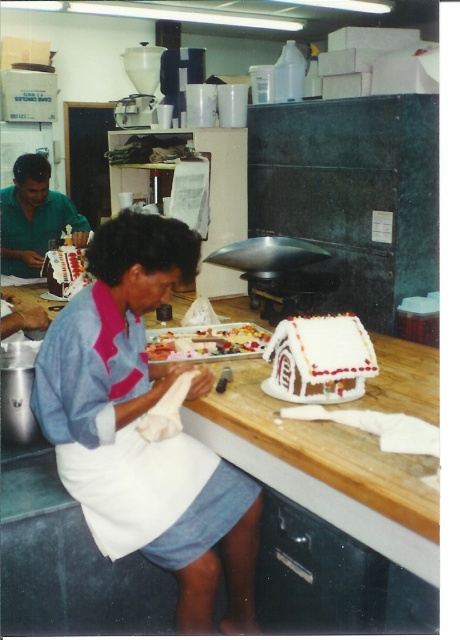
Question: Which of the following is the farthest from the observer?

Choices:
 (A) (356, 317)
 (B) (387, 488)
 (C) (212, 346)

Answer: (C)

Question: Among these objects, which one is farthest from the camera?

Choices:
 (A) white frosted gingerbread house at center
 (B) glazed sugar cookies at center
 (C) green matte shirt at upper left
 (D) blue fabric shirt at center

Answer: (C)

Question: Among these objects, which one is farthest from the camera?

Choices:
 (A) wooden at center
 (B) white frosted gingerbread house at center
 (C) green matte shirt at upper left
 (D) glazed sugar cookies at center

Answer: (C)

Question: Does white frosted gingerbread house at center have a lesser width compared to green matte shirt at upper left?

Choices:
 (A) yes
 (B) no

Answer: (A)

Question: Can you confirm if blue fabric shirt at center is smaller than wooden at center?

Choices:
 (A) yes
 (B) no

Answer: (A)

Question: Can you confirm if wooden at center is positioned to the left of glazed sugar cookies at center?

Choices:
 (A) yes
 (B) no

Answer: (B)